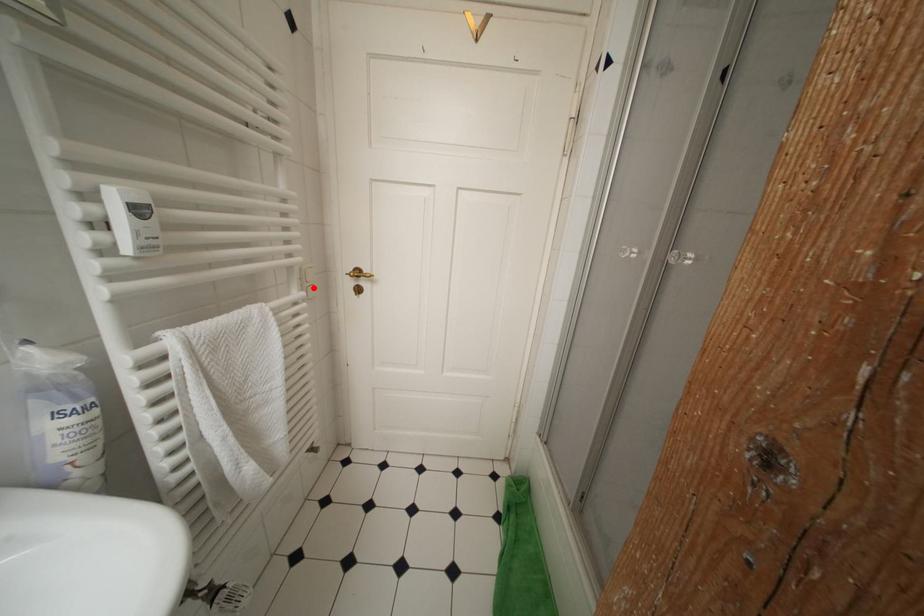
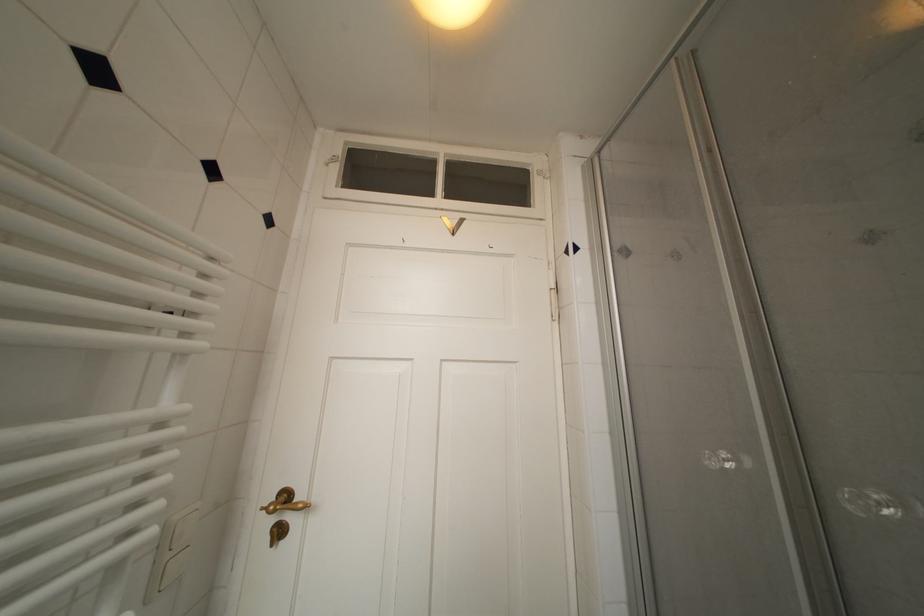
Locate, in the second image, the point that corresponds to the highlighted location in the first image.

(176, 559)